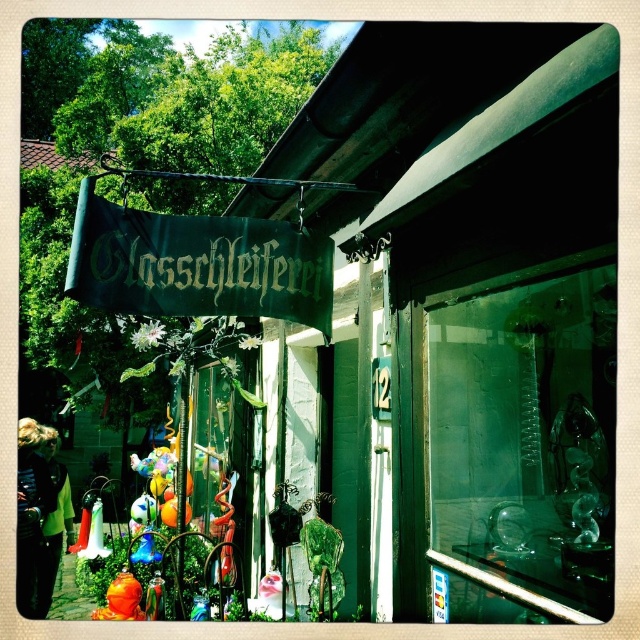
Who is positioned more to the right, transparent glass sculpture at center or green fabric sign at upper center?

Positioned to the right is transparent glass sculpture at center.

Who is shorter, transparent glass sculpture at center or green fabric sign at upper center?

green fabric sign at upper center is shorter.

At what (x,y) coordinates should I click in order to perform the action: click on transparent glass sculpture at center. Please return your answer as a coordinate pair (x, y). The width and height of the screenshot is (640, 640). Looking at the image, I should click on (524, 440).

The image size is (640, 640). What are the coordinates of `transparent glass sculpture at center` in the screenshot? It's located at (524, 440).